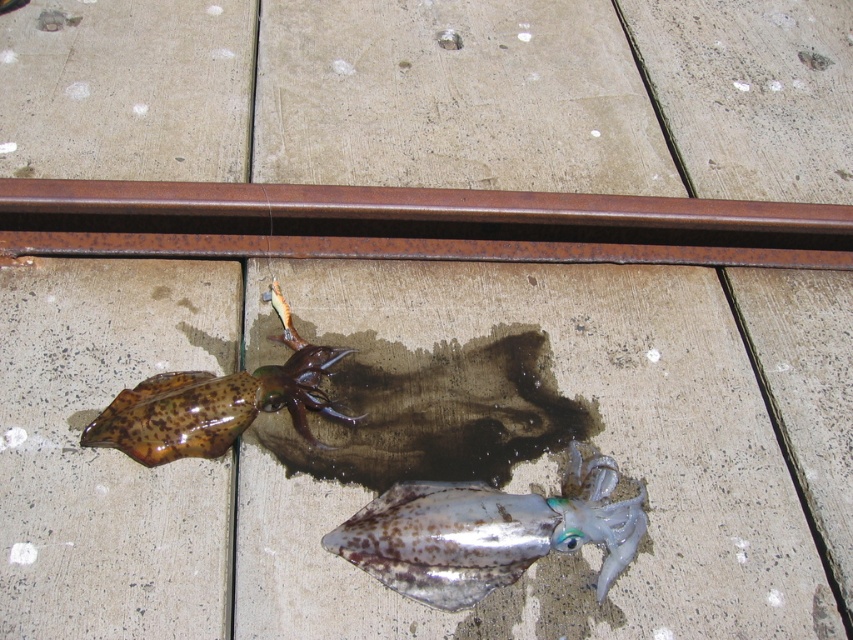
Is speckled translucent squid at center further to the viewer compared to brown glossy squid at upper left?

That is False.

Is speckled translucent squid at center above brown glossy squid at upper left?

Actually, speckled translucent squid at center is below brown glossy squid at upper left.

Measure the distance between speckled translucent squid at center and camera.

speckled translucent squid at center and camera are 3.83 feet apart.

Where is `speckled translucent squid at center`? This screenshot has height=640, width=853. speckled translucent squid at center is located at coordinates (488, 532).

Does rusty metal rail at center lie in front of speckled translucent squid at center?

No, rusty metal rail at center is behind speckled translucent squid at center.

This screenshot has width=853, height=640. Describe the element at coordinates (412, 225) in the screenshot. I see `rusty metal rail at center` at that location.

Which is in front, point (51, 204) or point (482, 536)?

Point (482, 536) is in front.

This screenshot has height=640, width=853. Find the location of `rusty metal rail at center`. rusty metal rail at center is located at coordinates (412, 225).

Can you confirm if rusty metal rail at center is taller than brown glossy squid at upper left?

Incorrect, rusty metal rail at center's height is not larger of brown glossy squid at upper left's.

Which is behind, point (144, 240) or point (276, 291)?

Point (144, 240)

In order to click on rusty metal rail at center in this screenshot , I will do `click(412, 225)`.